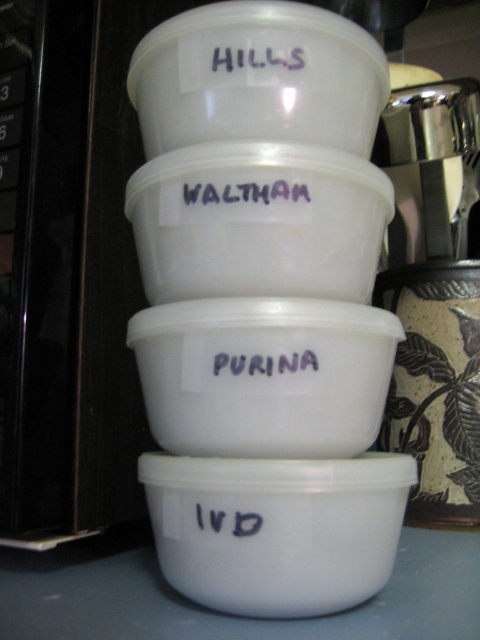
Does white matte bowl at lower center have a smaller size compared to white plastic bowl at upper center?

No, white matte bowl at lower center is not smaller than white plastic bowl at upper center.

Who is taller, white matte bowl at lower center or white plastic bowl at upper center?

With more height is white matte bowl at lower center.

Between point (264, 525) and point (241, 134), which one is positioned behind?

The point (241, 134) is behind.

The height and width of the screenshot is (640, 480). I want to click on white matte bowl at lower center, so click(x=276, y=529).

Between white matte bowl at lower center and transparent plastic bowl at center, which one appears on the right side from the viewer's perspective?

Positioned to the right is white matte bowl at lower center.

Is white matte bowl at lower center below transparent plastic bowl at center?

Yes.

In order to click on white matte bowl at lower center in this screenshot , I will do `click(276, 529)`.

In the scene shown: Does white matte bowl at center appear under black matte text at center?

Yes, white matte bowl at center is below black matte text at center.

Does point (277, 376) come closer to viewer compared to point (249, 374)?

Yes, point (277, 376) is in front of point (249, 374).

Is point (167, 413) positioned behind point (284, 368)?

Yes.

Locate an element on the screen. white matte bowl at center is located at coordinates (264, 376).